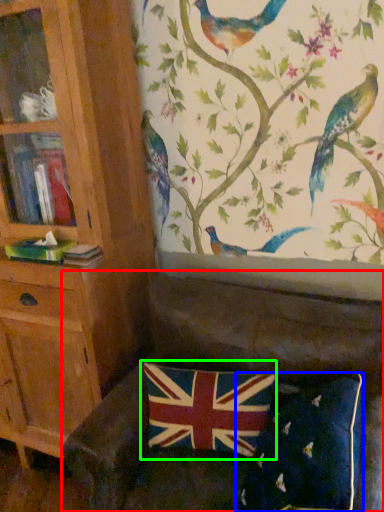
Question: Which object is the closest to the studio couch (highlighted by a red box)? Choose among these: pillow (highlighted by a blue box) or flag (highlighted by a green box).

Choices:
 (A) pillow
 (B) flag

Answer: (B)